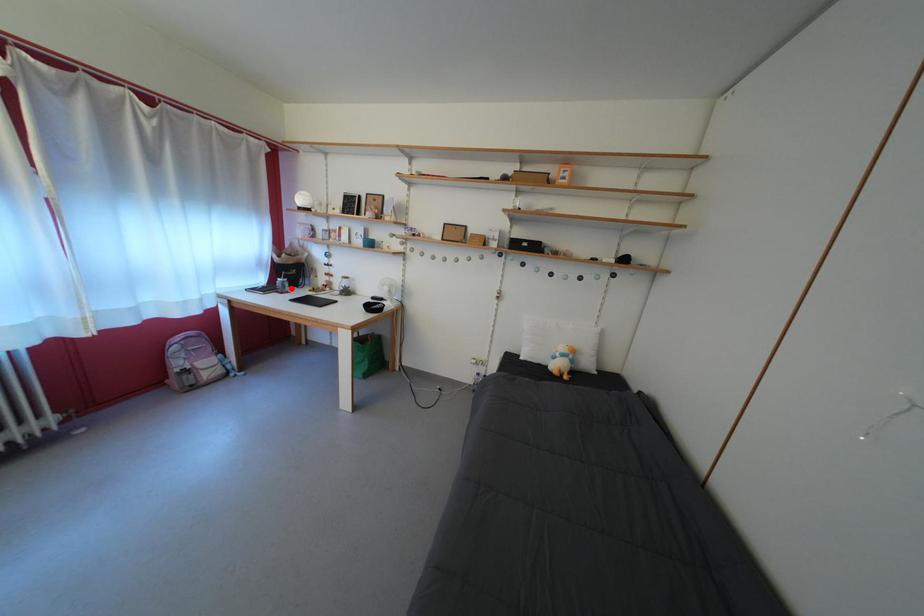
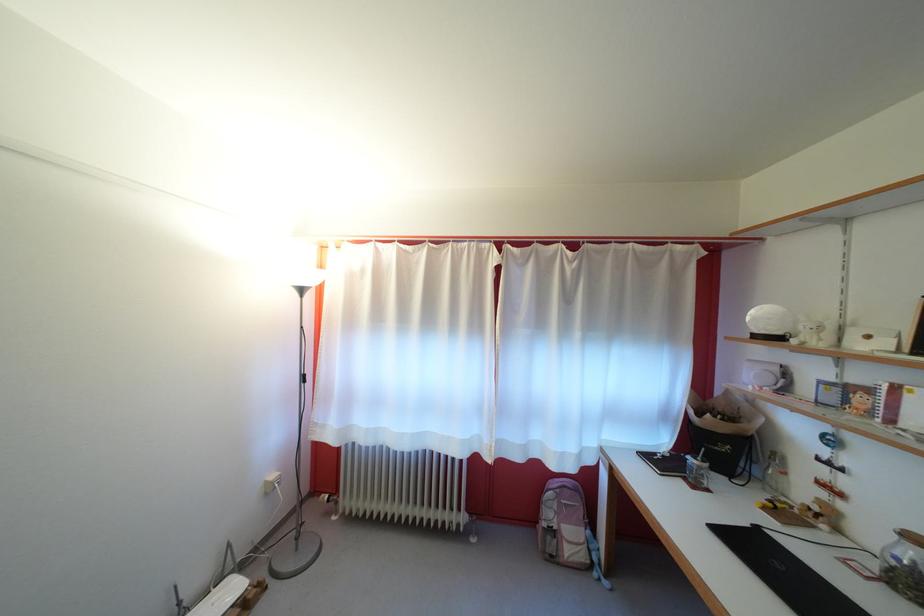
The point at the highlighted location is marked in the first image. Where is the corresponding point in the second image?

(708, 474)